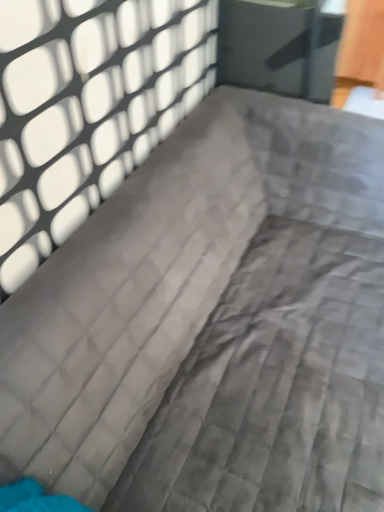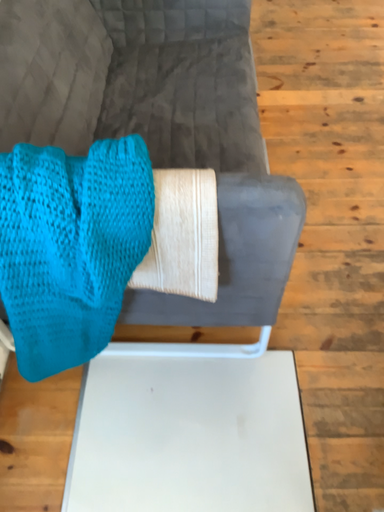
Question: Which way did the camera rotate in the video?

Choices:
 (A) rotated right
 (B) rotated left

Answer: (A)